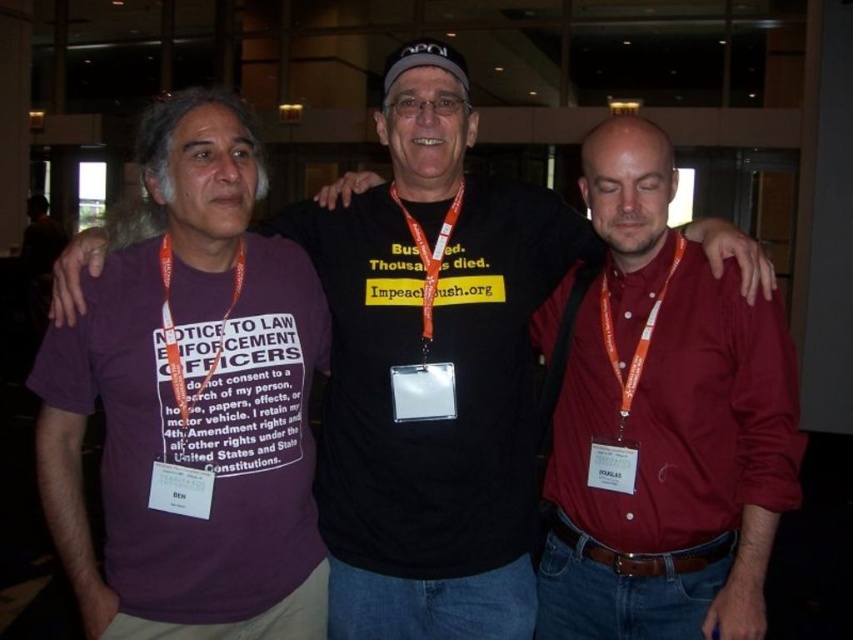
You are a photographer at the event and need to capture a clear photo of both the matte red shirt at center and the orange lanyard at left. Which one should you focus on first to ensure both are in focus?

The matte red shirt at center is further to the viewer than the orange lanyard at left, so you should focus on the matte red shirt at center first to ensure both are in focus.

You are at a conference and need to show your ID to security. You are wearing a matte red shirt at center and have a clear plastic badge at center. Can you easily access your badge without moving your shirt?

The matte red shirt at center is in front of the clear plastic badge at center, so you cannot easily access your badge without moving your shirt.